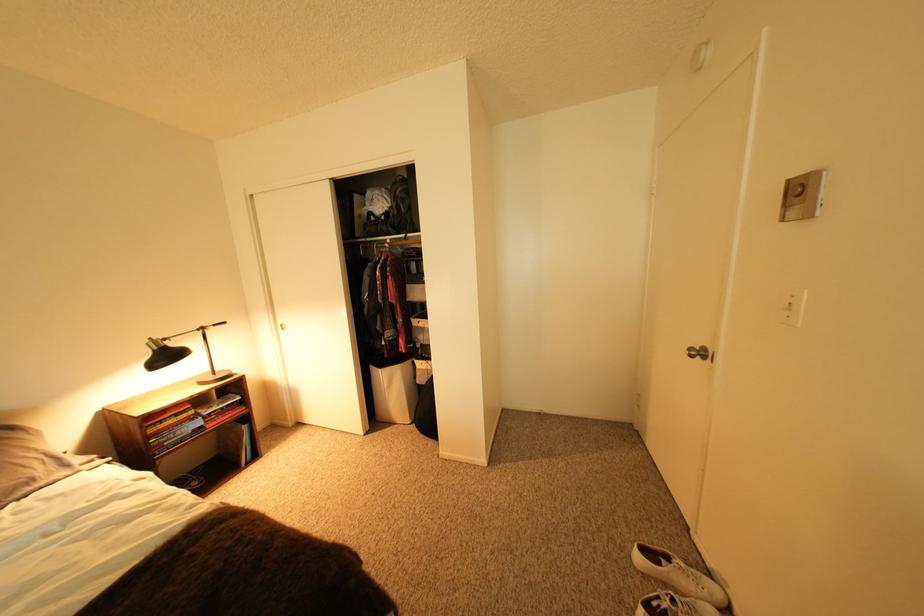
I want to click on black lamp head, so click(x=163, y=354).